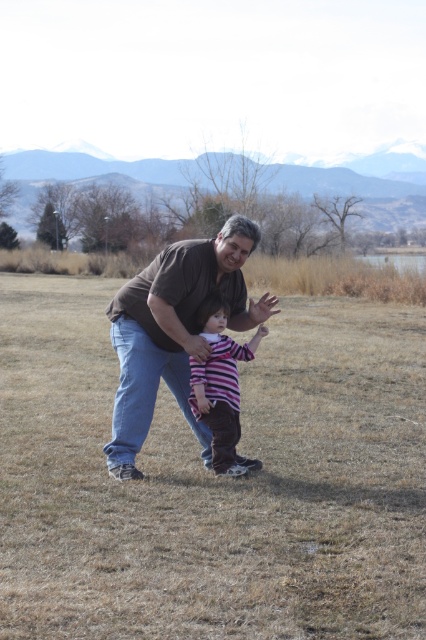
You are a photographer setting up a shot of two people in a grassy field. You need to ensure the adult in the brown cotton shirt at center is framed properly with the child in the striped cotton shirt at center. Based on their heights, which shirt should be placed lower in the frame to maintain balance?

The striped cotton shirt at center is shorter than the brown cotton shirt at center. To maintain balance, the shorter striped cotton shirt at center should be placed lower in the frame so that their visual weights align appropriately.

You are a photographer trying to capture a photo of the two people in the scene. The adult is wearing a brown cotton shirt at center and the child is wearing a striped cotton shirt at center. Based on their clothing sizes, which shirt do you think belongs to the adult?

The brown cotton shirt at center has a larger width than the striped cotton shirt at center, so the brown cotton shirt at center belongs to the adult.